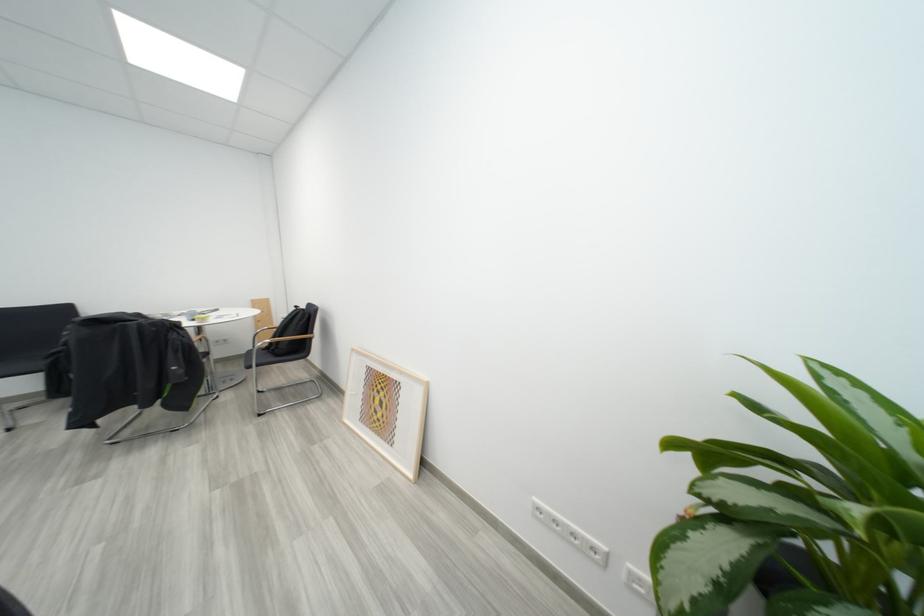
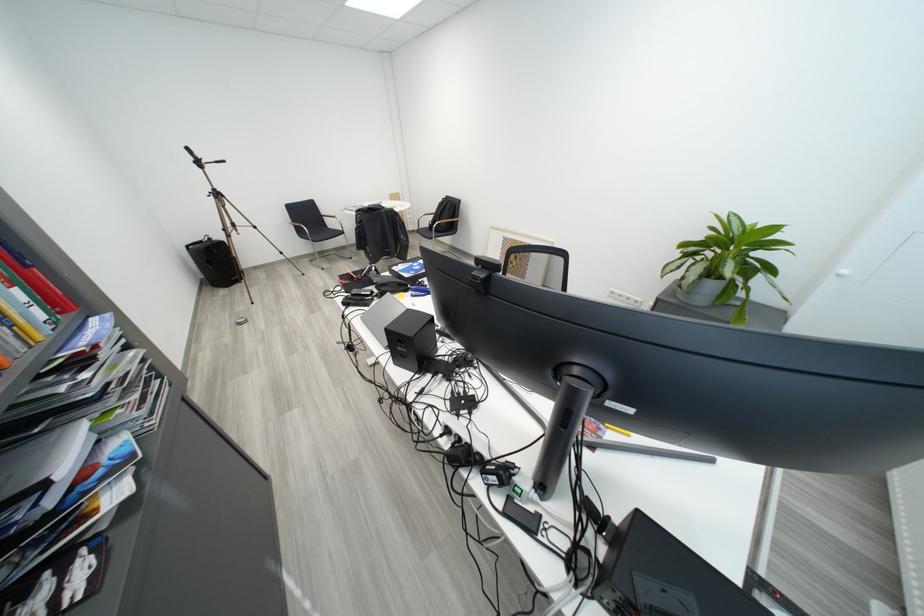
Consider the image. The images are taken continuously from a first-person perspective. In which direction are you moving?

The cameraman moved toward left, backward.